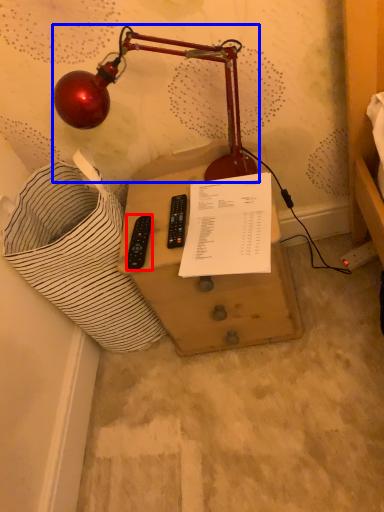
Question: Which object appears closest to the camera in this image, control (highlighted by a red box) or lamp (highlighted by a blue box)?

Choices:
 (A) control
 (B) lamp

Answer: (B)